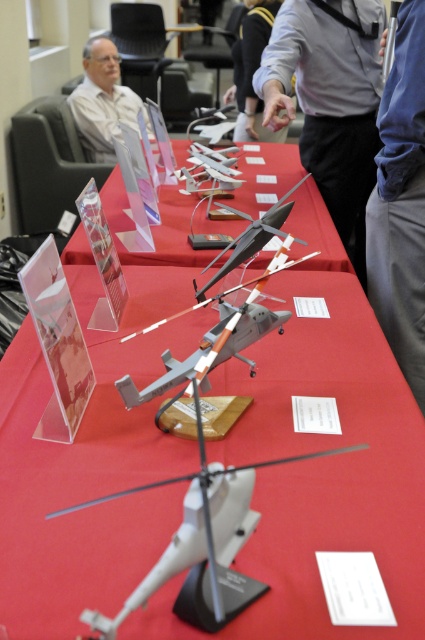
You are standing in front of the helicopter display and want to take a photo of the two points mentioned. Which point, point [360,220] or point [263,108], will appear larger in your photo?

Point [360,220] will appear larger in the photo because it is closer to the camera than point [263,108].

Consider the image. You are standing in front of the display setup and want to see both the red matte tablecloth at center and the gray fabric shirt at upper center clearly. Which object is closer to you?

The red matte tablecloth at center is closer to you since it is in front of the gray fabric shirt at upper center.

You are standing in front of the helicopter display and notice two blue fabric items. The blue fabric pants at lower right and the blue fabric shirt at upper center. Which one is positioned more to the right side of the display?

The blue fabric pants at lower right is positioned more to the right side of the display compared to the blue fabric shirt at upper center.